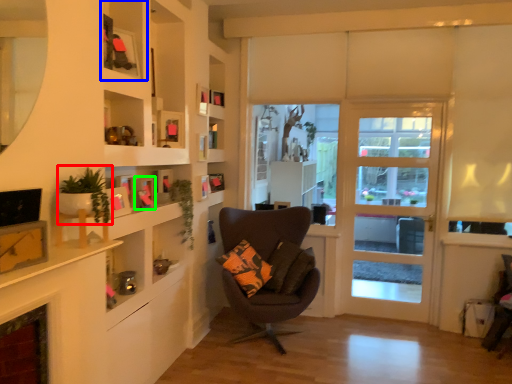
Question: Which is nearer to the plant (highlighted by a red box)? shelf (highlighted by a blue box) or picture frame (highlighted by a green box).

Choices:
 (A) shelf
 (B) picture frame

Answer: (A)